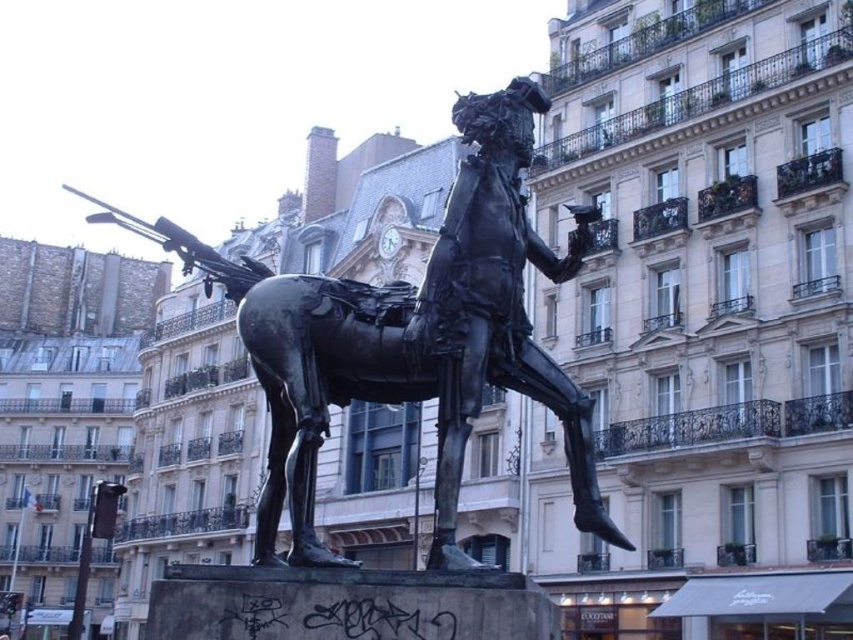
You are standing at the center of the city square and want to take a photo of the bronze statue at center. If you move 0.1 units to the right, will the statue still be in the frame? Assume the camera has a horizontal field of view of 0.2 units.

The bronze statue at center is located at point (408, 337). Moving 0.1 units to the right would shift your position to 0.627, so the statue would be at 0.527, which is 0.1 units left of your new position. Since the camera has a horizontal field of view of 0.2 units, the statue would still be within the frame as it is within the 0.1 unit left of center to 0.1 unit right of center range.

You are an art student standing in the square and want to sketch the bronze statue at center and the polished metal gun at upper left. Which object should you focus on first to capture their relative sizes accurately?

The bronze statue at center is closer to the viewer than the polished metal gun at upper left, so it appears larger. Focus on sketching the bronze statue at center first to capture its larger size before moving on to the smaller, more distant polished metal gun at upper left.